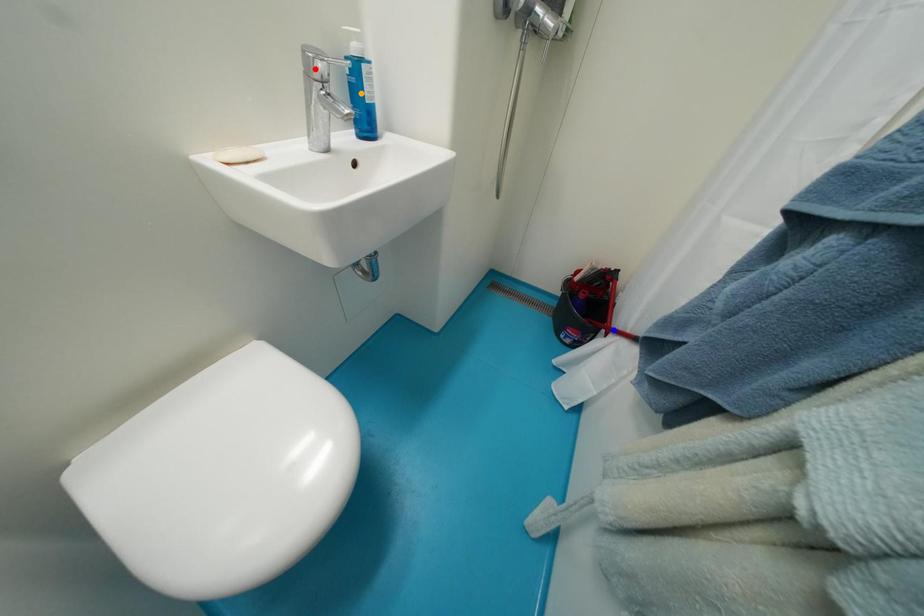
Order these from nearest to farthest:
A) red point
B) blue point
C) orange point

1. blue point
2. orange point
3. red point